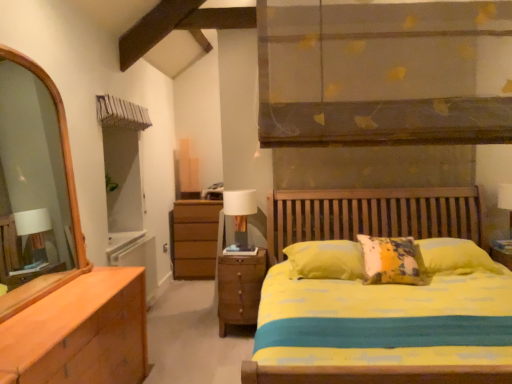
Describe the element at coordinates (240, 288) in the screenshot. The image size is (512, 384). I see `wooden nightstand at lower center` at that location.

In order to face wooden nightstand at lower center, should I rotate leftwards or rightwards?

Turn left by 1.560 degrees to look at wooden nightstand at lower center.

This screenshot has height=384, width=512. In order to click on wooden nightstand at lower center in this screenshot , I will do `click(240, 288)`.

Measure the distance between white fabric-covered table lamp at center and camera.

3.65 meters.

Locate an element on the screen. white fabric-covered table lamp at center is located at coordinates (240, 213).

What do you see at coordinates (240, 213) in the screenshot? I see `white fabric-covered table lamp at center` at bounding box center [240, 213].

Locate an element on the screen. The image size is (512, 384). wooden nightstand at lower center is located at coordinates (240, 288).

Can you confirm if wooden nightstand at lower center is positioned to the right of white fabric-covered table lamp at center?

Correct, you'll find wooden nightstand at lower center to the right of white fabric-covered table lamp at center.

Considering the relative positions of wooden nightstand at lower center and white fabric-covered table lamp at center in the image provided, is wooden nightstand at lower center behind white fabric-covered table lamp at center?

No, it is in front of white fabric-covered table lamp at center.

Is point (222, 333) positioned behind point (242, 235)?

No, (222, 333) is closer to viewer.

From the image's perspective, between wooden nightstand at lower center and white fabric-covered table lamp at center, who is located below?

wooden nightstand at lower center.

From a real-world perspective, is wooden nightstand at lower center above or below white fabric-covered table lamp at center?

Clearly, from a real-world perspective, wooden nightstand at lower center is below white fabric-covered table lamp at center.

Between wooden nightstand at lower center and white fabric-covered table lamp at center, which one has larger width?

Wider between the two is wooden nightstand at lower center.

Can you confirm if wooden nightstand at lower center is shorter than white fabric-covered table lamp at center?

In fact, wooden nightstand at lower center may be taller than white fabric-covered table lamp at center.

Consider the image. Can you confirm if wooden nightstand at lower center is smaller than white fabric-covered table lamp at center?

Incorrect, wooden nightstand at lower center is not smaller in size than white fabric-covered table lamp at center.

Could white fabric-covered table lamp at center be considered to be inside wooden nightstand at lower center?

Definitely not — white fabric-covered table lamp at center is not inside wooden nightstand at lower center.

Are wooden nightstand at lower center and white fabric-covered table lamp at center beside each other?

No, wooden nightstand at lower center is not touching white fabric-covered table lamp at center.

Is wooden nightstand at lower center turned away from white fabric-covered table lamp at center?

Answer: No, white fabric-covered table lamp at center is not at the back of wooden nightstand at lower center.

How distant is wooden nightstand at lower center from white fabric-covered table lamp at center?

wooden nightstand at lower center is 14.33 inches away from white fabric-covered table lamp at center.

At what (x,y) coordinates should I click in order to perform the action: click on table lamp above the wooden nightstand at lower center (from a real-world perspective). Please return your answer as a coordinate pair (x, y). This screenshot has width=512, height=384. Looking at the image, I should click on (240, 213).

Can you confirm if white fabric-covered table lamp at center is positioned to the left of wooden nightstand at lower center?

Correct, you'll find white fabric-covered table lamp at center to the left of wooden nightstand at lower center.

Does white fabric-covered table lamp at center lie behind wooden nightstand at lower center?

That is True.

Is point (252, 212) closer to camera compared to point (258, 280)?

No, it is not.

From the picture: From the image's perspective, is white fabric-covered table lamp at center over wooden nightstand at lower center?

Yes.

From a real-world perspective, is white fabric-covered table lamp at center positioned above or below wooden nightstand at lower center?

Clearly, from a real-world perspective, white fabric-covered table lamp at center is above wooden nightstand at lower center.

Is white fabric-covered table lamp at center wider than wooden nightstand at lower center?

No.

Who is taller, white fabric-covered table lamp at center or wooden nightstand at lower center?

With more height is wooden nightstand at lower center.

Between white fabric-covered table lamp at center and wooden nightstand at lower center, which one has larger size?

With larger size is wooden nightstand at lower center.

Is white fabric-covered table lamp at center inside the boundaries of wooden nightstand at lower center, or outside?

white fabric-covered table lamp at center lies outside wooden nightstand at lower center.

Is white fabric-covered table lamp at center placed right next to wooden nightstand at lower center?

No, white fabric-covered table lamp at center is not making contact with wooden nightstand at lower center.

Is white fabric-covered table lamp at center positioned with its back to wooden nightstand at lower center?

That's not correct — white fabric-covered table lamp at center is not looking away from wooden nightstand at lower center.

The width and height of the screenshot is (512, 384). I want to click on nightstand in front of the white fabric-covered table lamp at center, so click(240, 288).

Where is `table lamp behind the wooden nightstand at lower center`? The image size is (512, 384). table lamp behind the wooden nightstand at lower center is located at coordinates click(x=240, y=213).

Where is `table lamp on the left of wooden nightstand at lower center`? This screenshot has height=384, width=512. table lamp on the left of wooden nightstand at lower center is located at coordinates (240, 213).